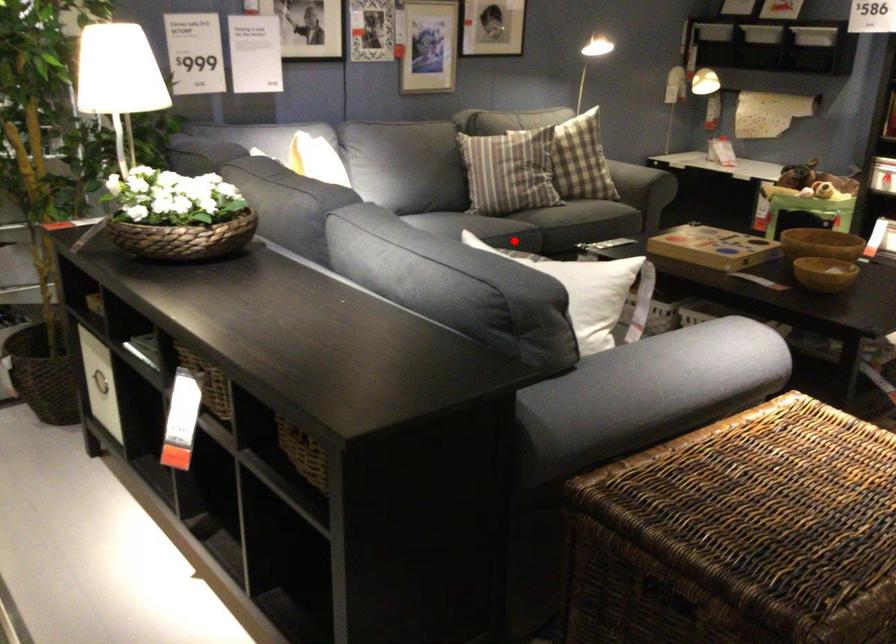
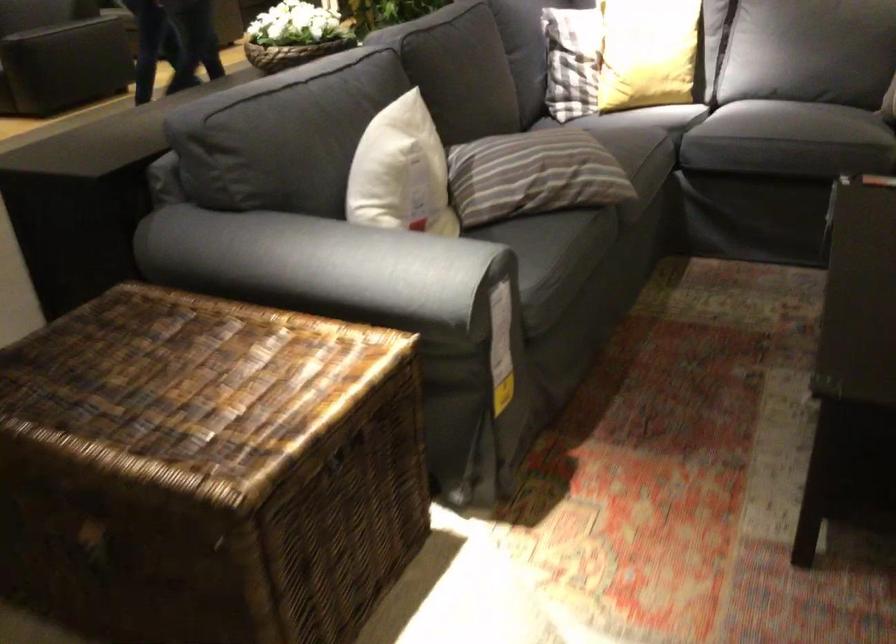
Where in the second image is the point corresponding to the highlighted location from the first image?

(768, 122)